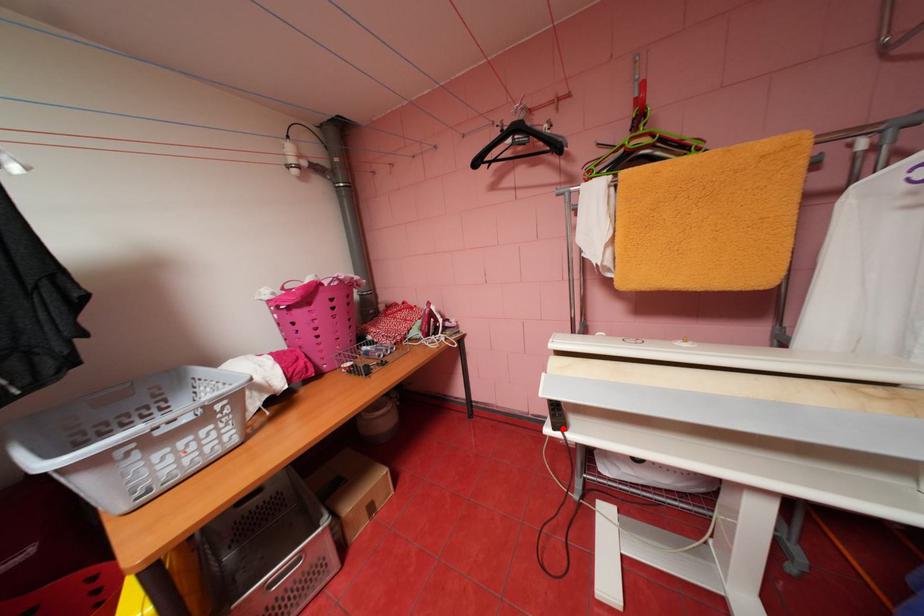
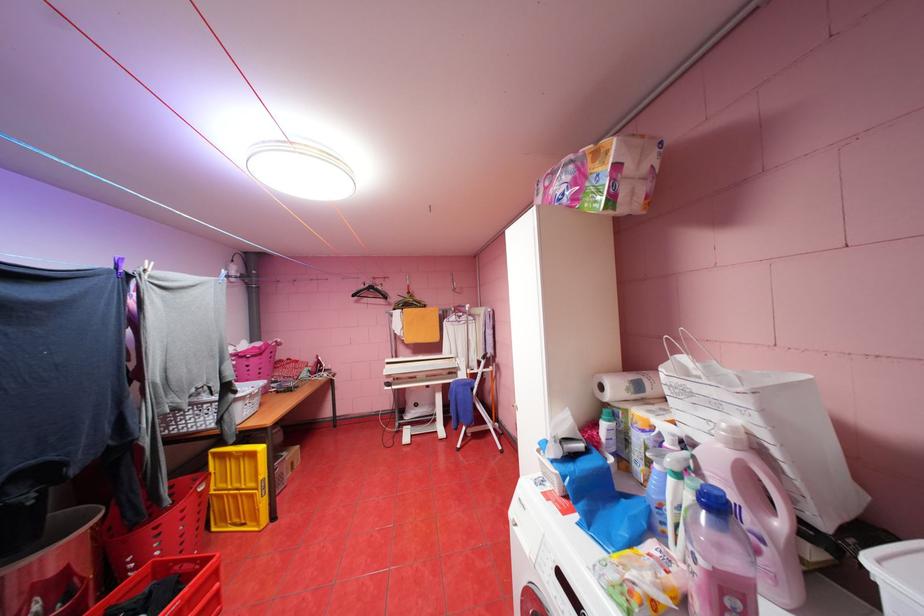
Question: I am providing you with two images of the same scene from different viewpoints. Given a red point in image1, look at the same physical point in image2. Is it:

Choices:
 (A) Closer to the viewpoint
 (B) Farther from the viewpoint

Answer: (B)